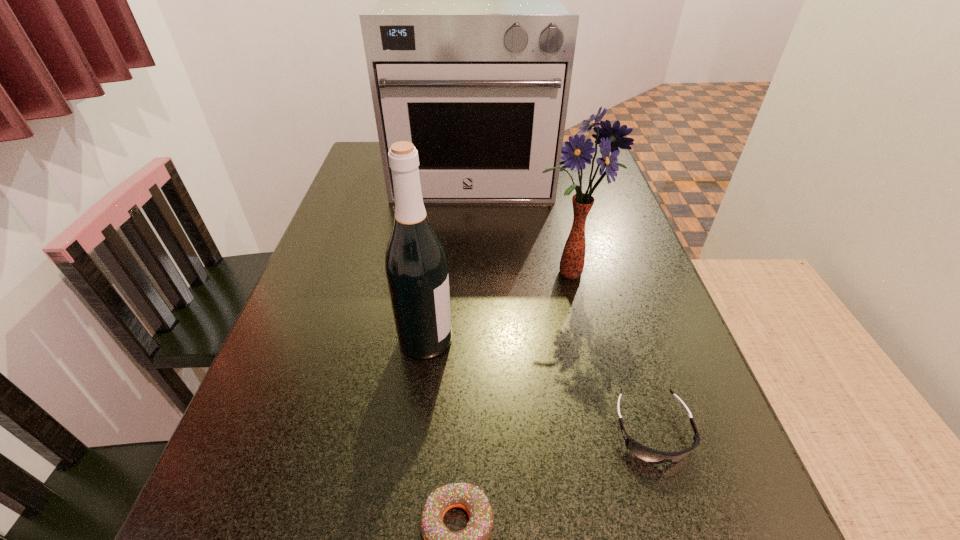
The image size is (960, 540). In order to click on flower arrangement located at the right edge in this screenshot , I will do `click(576, 152)`.

I want to click on goggles present at the right edge, so click(645, 453).

Find the location of `object situated at the far left corner`. object situated at the far left corner is located at coordinates (469, 51).

Identify the location of vacant space at the left edge of the desktop. (372, 190).

In the image, there is a desktop. At what (x,y) coordinates should I click in order to perform the action: click on vacant area at the right edge. Please return your answer as a coordinate pair (x, y). The width and height of the screenshot is (960, 540). Looking at the image, I should click on (653, 338).

The image size is (960, 540). What are the coordinates of `free point between the wine bottle and the farthest object` in the screenshot? It's located at (449, 255).

Where is `blank region between the fourth nearest object and the farthest object`? This screenshot has width=960, height=540. blank region between the fourth nearest object and the farthest object is located at coordinates (520, 222).

Identify the location of free spot between the fourth nearest object and the wine bottle. The width and height of the screenshot is (960, 540). (497, 307).

Find the location of `free space between the fourth nearest object and the second nearest object`. free space between the fourth nearest object and the second nearest object is located at coordinates (611, 352).

Find the location of `free area in between the farthest object and the third farthest object`. free area in between the farthest object and the third farthest object is located at coordinates (449, 255).